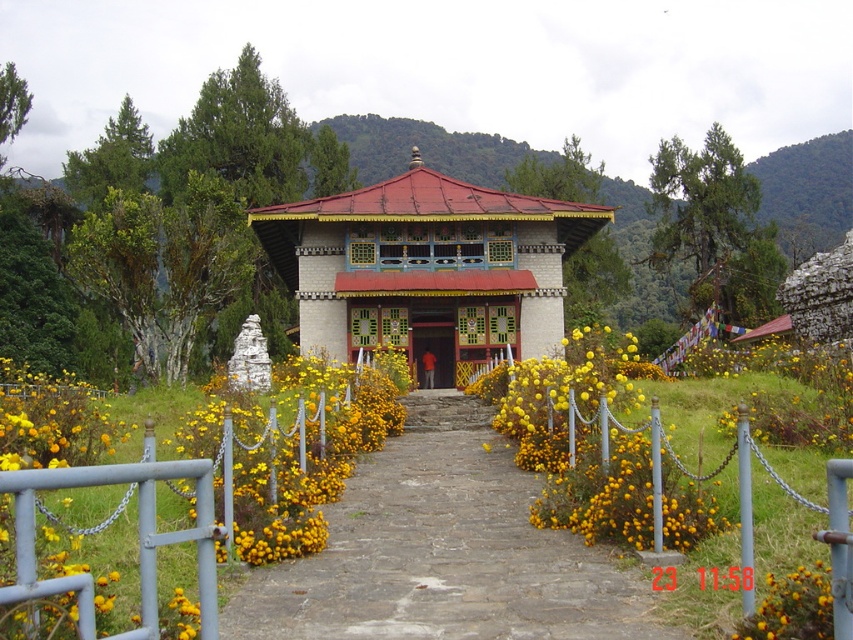
Does stone paved pathway at center appear over matte white gazebo at center?

Incorrect, stone paved pathway at center is not positioned above matte white gazebo at center.

Does stone paved pathway at center appear on the left side of matte white gazebo at center?

In fact, stone paved pathway at center is to the right of matte white gazebo at center.

Find the location of `stone paved pathway at center`. stone paved pathway at center is located at coordinates (444, 552).

Image resolution: width=853 pixels, height=640 pixels. Describe the element at coordinates (444, 552) in the screenshot. I see `stone paved pathway at center` at that location.

Who is higher up, stone paved pathway at center or yellow matte flowers at center?

Positioned higher is yellow matte flowers at center.

The height and width of the screenshot is (640, 853). What do you see at coordinates (444, 552) in the screenshot?
I see `stone paved pathway at center` at bounding box center [444, 552].

In order to click on stone paved pathway at center in this screenshot , I will do `click(444, 552)`.

Is matte white gazebo at center closer to camera compared to yellow matte flowers at center?

No, it is behind yellow matte flowers at center.

Looking at this image, is matte white gazebo at center positioned at the back of yellow matte flowers at center?

That is True.

Does point (352, 349) come closer to viewer compared to point (283, 467)?

No, it is behind (283, 467).

Locate an element on the screen. The height and width of the screenshot is (640, 853). matte white gazebo at center is located at coordinates (427, 264).